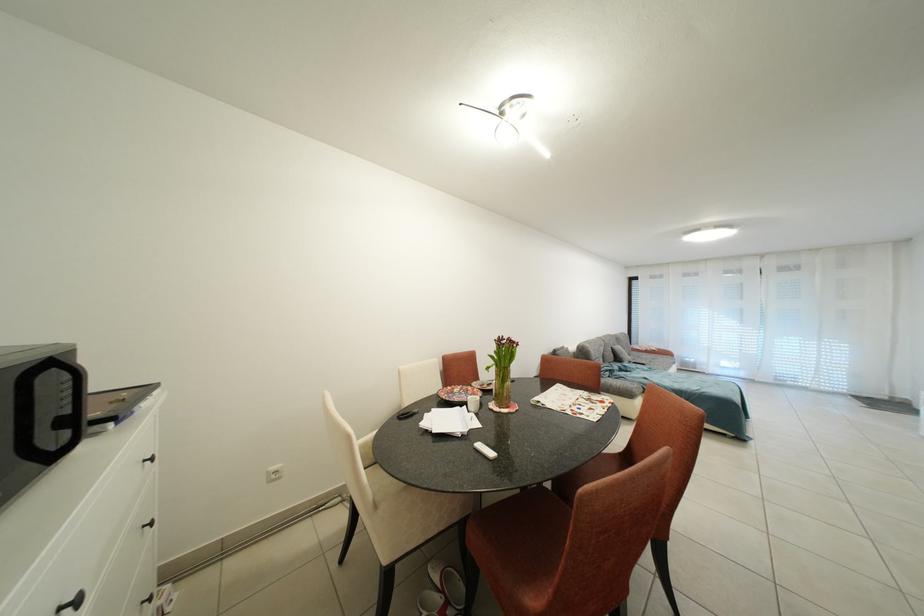
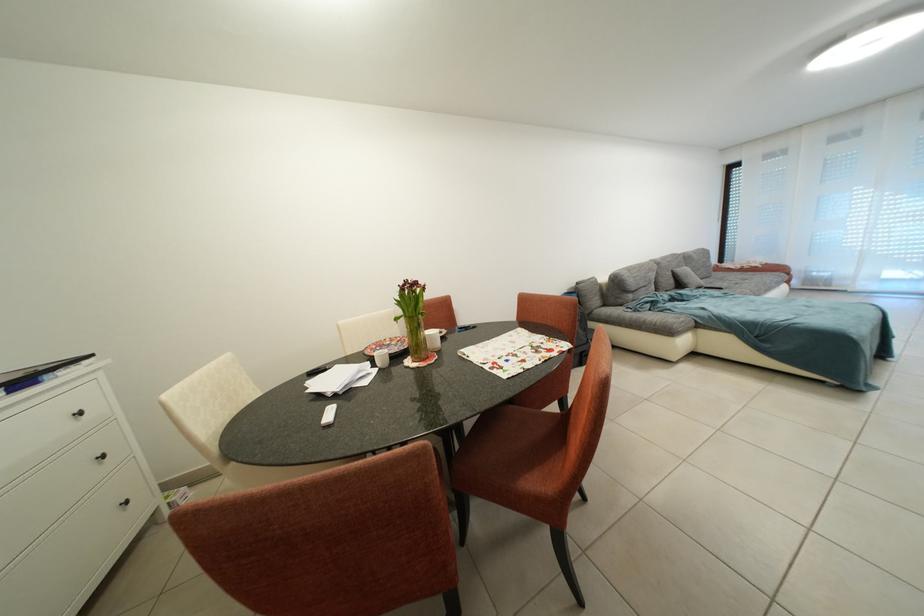
In a continuous first-person perspective shot, in which direction is the camera moving?

The movement direction of the cameraman is right, forward.